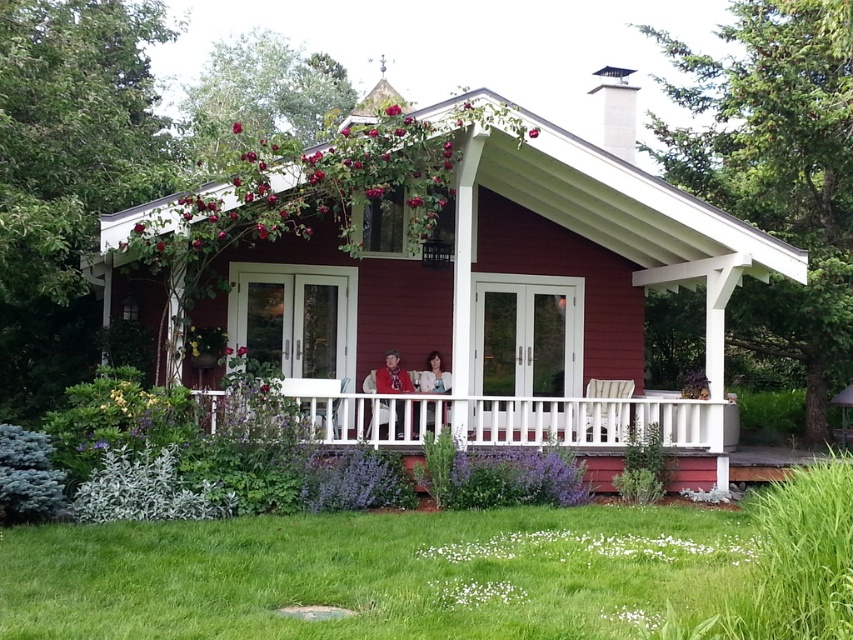
Is matte red cottage at center further to the viewer compared to smooth glossy rose at upper center?

Yes, matte red cottage at center is behind smooth glossy rose at upper center.

Image resolution: width=853 pixels, height=640 pixels. What do you see at coordinates (523, 300) in the screenshot?
I see `matte red cottage at center` at bounding box center [523, 300].

Who is more distant from viewer, (x=543, y=156) or (x=241, y=125)?

The point (x=543, y=156) is more distant.

This screenshot has width=853, height=640. I want to click on matte red cottage at center, so click(x=523, y=300).

Does point (494, 444) come farther from viewer compared to point (564, 557)?

Yes, point (494, 444) is farther from viewer.

Is white wooden porch at center wider than white fluffy petals at lower center?

Yes.

Which is in front, point (471, 400) or point (534, 541)?

Point (534, 541)

The height and width of the screenshot is (640, 853). I want to click on white wooden porch at center, so click(x=518, y=419).

Who is taller, matte red cottage at center or red matte rose at center?

Standing taller between the two is matte red cottage at center.

Does matte red cottage at center have a smaller size compared to red matte rose at center?

No, matte red cottage at center is not smaller than red matte rose at center.

Who is more distant from viewer, (622, 109) or (242, 346)?

Positioned behind is point (622, 109).

In order to click on matte red cottage at center in this screenshot , I will do `click(523, 300)`.